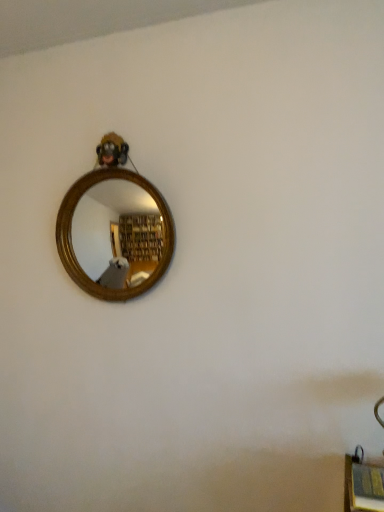
In order to face wooden bookshelf at lower right, should I rotate leftwards or rightwards?

You should look right and rotate roughly 25.681 degrees.

This screenshot has width=384, height=512. What do you see at coordinates (363, 486) in the screenshot? I see `wooden bookshelf at lower right` at bounding box center [363, 486].

Image resolution: width=384 pixels, height=512 pixels. What are the coordinates of `wooden bookshelf at lower right` in the screenshot? It's located at (363, 486).

The image size is (384, 512). I want to click on wooden bookshelf at lower right, so click(x=363, y=486).